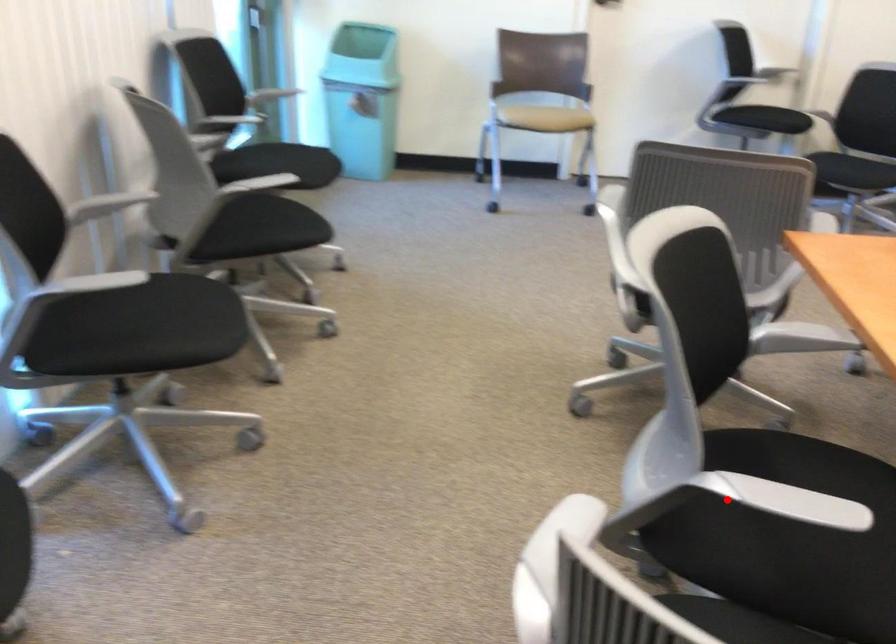
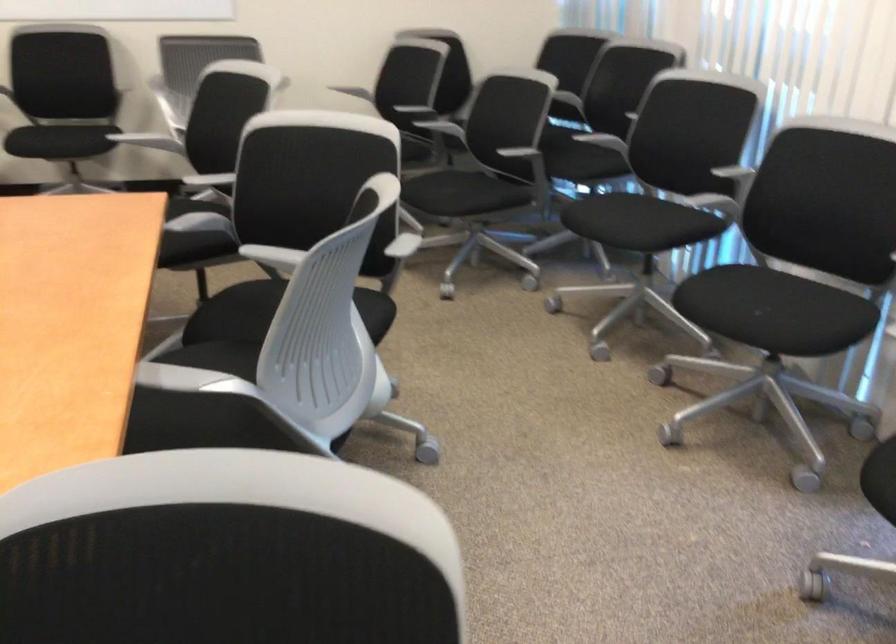
Find the pixel in the second image that matches the highlighted location in the first image.

(273, 258)